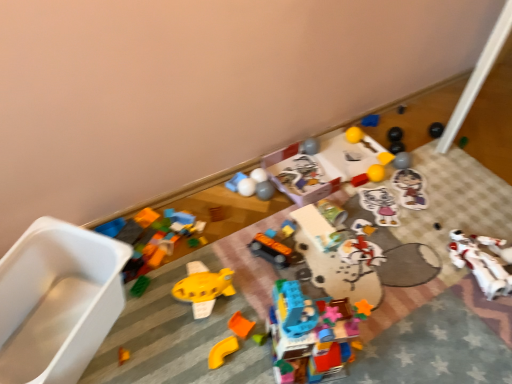
Locate an element on the screen. The width and height of the screenshot is (512, 384). vacant space that's between matte white plush cat at center, the thirteenth toy viewed from the left, and white plastic robot at lower right, which appears as the seventeenth toy when viewed from the left is located at coordinates (424, 235).